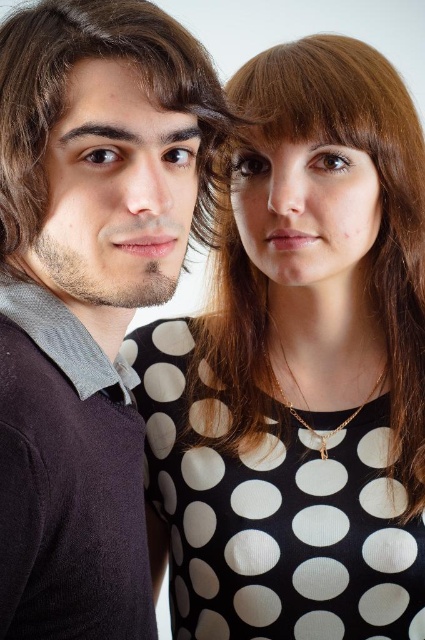
You are a photographer adjusting the focus on your camera. You notice two points in the image at coordinates point (401, 429) and point (47, 193). Which point should you focus on first to ensure the subject closer to the camera is in sharp focus?

Point (401, 429) is further to the camera than point (47, 193), so you should focus on point (401, 429) first to ensure the subject closer to the camera is in sharp focus.

You are a photographer trying to adjust the framing of two people in a photo. The young man on the left is standing at point A and the young woman on the right is standing at point B. You need to place a golden ratio point at point C, which is at coordinates (377,195). Based on the scene description, which person is closer to point C?

The brown silky hair at upper right is located at point C, which is part of the young woman on the right. Therefore, the young woman on the right is closer to point C.

You are a photographer trying to position two models for a photo shoot. The models have brown silky hair at upper right and brown matte hair at left. Based on their positions, which model should stand to the left side of the camera to ensure their hair is visible in the frame?

The brown matte hair at left should stand to the left side of the camera because the brown silky hair at upper right is positioned to the right of the brown matte hair at left, so placing the model with brown matte hair at left on the left side will keep their hair visible and aligned with their current positions.